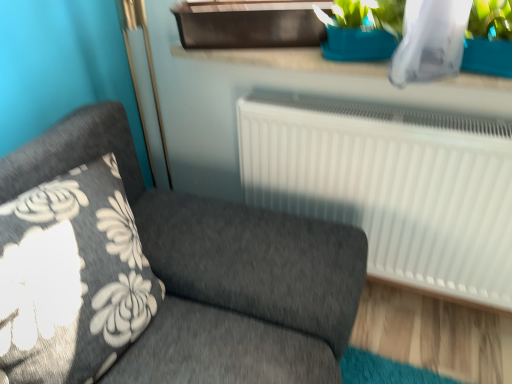
Question: Is blue plastic window sill at upper center surrounding dark gray fabric couch at left?

Choices:
 (A) yes
 (B) no

Answer: (B)

Question: Is blue plastic window sill at upper center thinner than dark gray fabric couch at left?

Choices:
 (A) yes
 (B) no

Answer: (A)

Question: From the image's perspective, does blue plastic window sill at upper center appear higher than dark gray fabric couch at left?

Choices:
 (A) yes
 (B) no

Answer: (A)

Question: From a real-world perspective, is blue plastic window sill at upper center below dark gray fabric couch at left?

Choices:
 (A) no
 (B) yes

Answer: (A)

Question: Is the depth of blue plastic window sill at upper center less than that of dark gray fabric couch at left?

Choices:
 (A) no
 (B) yes

Answer: (A)

Question: Can you confirm if blue plastic window sill at upper center is smaller than dark gray fabric couch at left?

Choices:
 (A) yes
 (B) no

Answer: (A)

Question: Can you see dark gray fabric couch at left touching blue plastic window sill at upper center?

Choices:
 (A) yes
 (B) no

Answer: (B)

Question: From the image's perspective, is dark gray fabric couch at left below blue plastic window sill at upper center?

Choices:
 (A) yes
 (B) no

Answer: (A)

Question: Is dark gray fabric couch at left facing away from blue plastic window sill at upper center?

Choices:
 (A) yes
 (B) no

Answer: (B)

Question: From a real-world perspective, does dark gray fabric couch at left sit lower than blue plastic window sill at upper center?

Choices:
 (A) yes
 (B) no

Answer: (A)

Question: Does dark gray fabric couch at left appear on the left side of blue plastic window sill at upper center?

Choices:
 (A) yes
 (B) no

Answer: (A)

Question: Would you say blue plastic window sill at upper center is part of dark gray fabric couch at left's contents?

Choices:
 (A) no
 (B) yes

Answer: (A)

Question: Looking at their shapes, would you say dark gray fabric couch at left is wider or thinner than blue plastic window sill at upper center?

Choices:
 (A) thin
 (B) wide

Answer: (B)